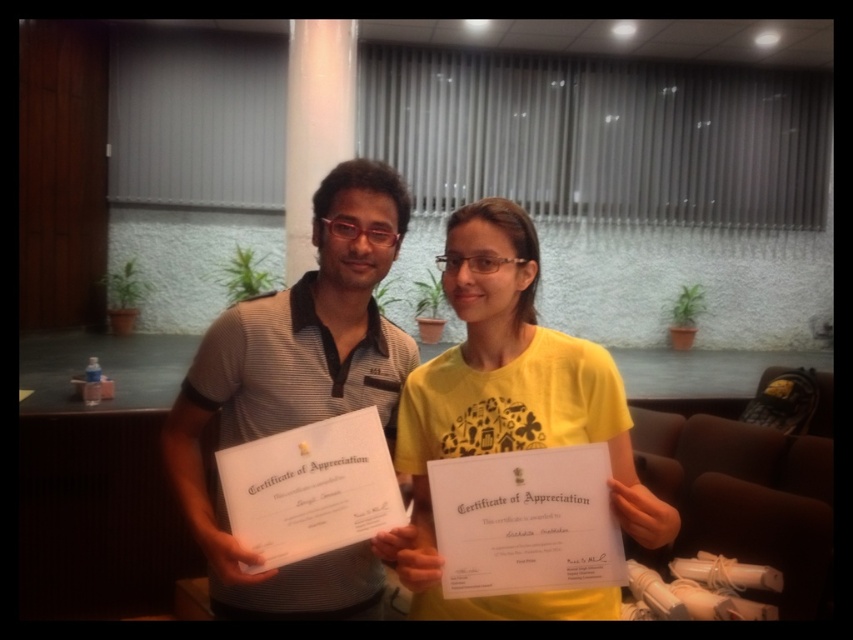
Is matte gray shirt at center to the left of yellow matte shirt at center from the viewer's perspective?

Correct, you'll find matte gray shirt at center to the left of yellow matte shirt at center.

Based on the photo, who is positioned more to the left, matte gray shirt at center or yellow matte shirt at center?

matte gray shirt at center

This screenshot has width=853, height=640. What do you see at coordinates (300, 394) in the screenshot?
I see `matte gray shirt at center` at bounding box center [300, 394].

This screenshot has width=853, height=640. Identify the location of matte gray shirt at center. (300, 394).